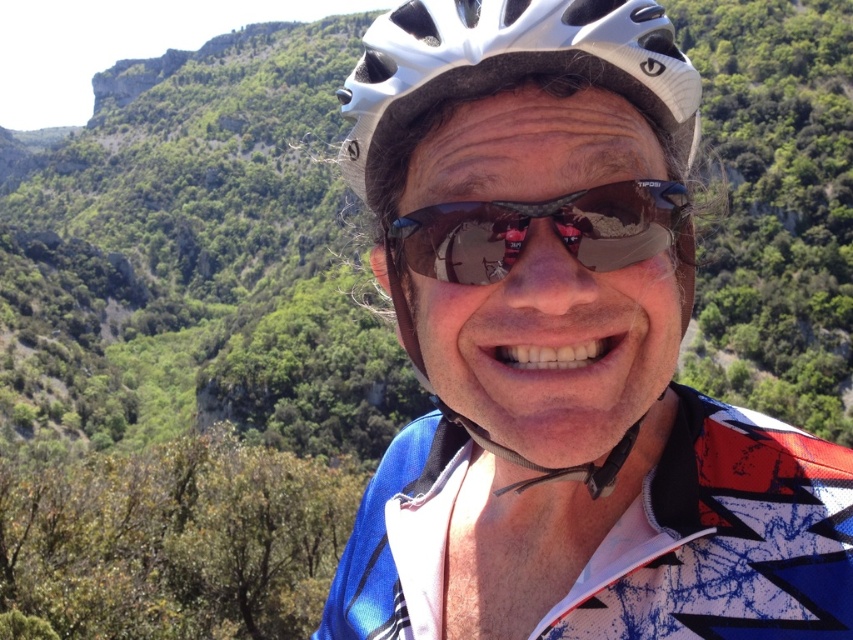
Is point (514, 20) behind point (412, 58)?

No, (514, 20) is in front of (412, 58).

At what (x,y) coordinates should I click in order to perform the action: click on white matte helmet at center. Please return your answer as a coordinate pair (x, y). Looking at the image, I should click on (561, 352).

At what (x,y) coordinates should I click in order to perform the action: click on white matte helmet at center. Please return your answer as a coordinate pair (x, y). This screenshot has width=853, height=640. Looking at the image, I should click on (561, 352).

Identify the location of white matte helmet at center. (561, 352).

Between white matte helmet at center and shiny reflective sunglasses at center, which one appears on the left side from the viewer's perspective?

shiny reflective sunglasses at center is more to the left.

Is point (570, 218) farther from viewer compared to point (682, 186)?

That is False.

I want to click on white matte helmet at center, so click(561, 352).

Between white matte bicycle helmet at center and shiny reflective sunglasses at center, which one appears on the left side from the viewer's perspective?

Positioned to the left is white matte bicycle helmet at center.

Is white matte bicycle helmet at center wider than shiny reflective sunglasses at center?

Indeed, white matte bicycle helmet at center has a greater width compared to shiny reflective sunglasses at center.

Is point (558, 51) positioned after point (601, 211)?

No, (558, 51) is in front of (601, 211).

Image resolution: width=853 pixels, height=640 pixels. I want to click on white matte bicycle helmet at center, so click(512, 65).